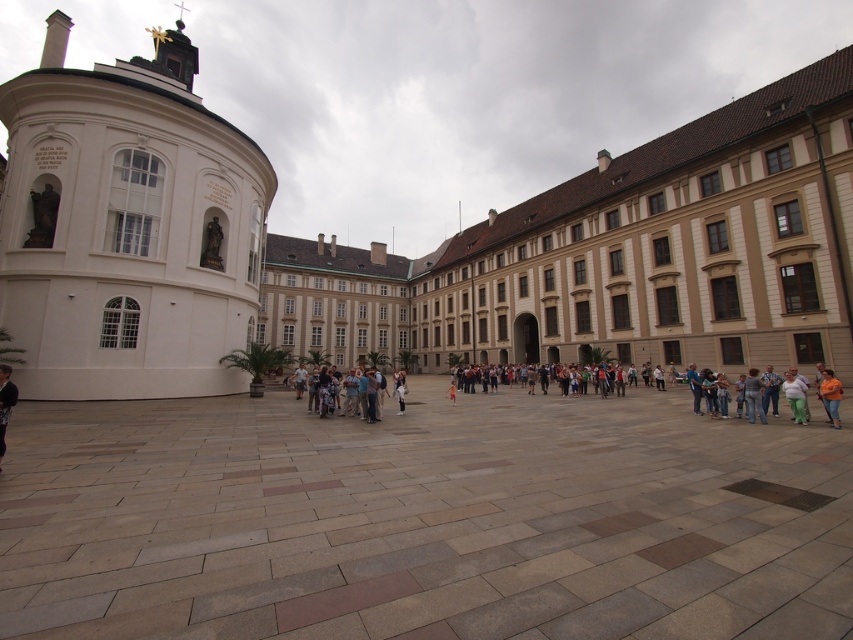
Question: Which point is farther to the camera?

Choices:
 (A) (376, 392)
 (B) (753, 380)
 (C) (169, 300)

Answer: (C)

Question: Among these objects, which one is nearest to the camera?

Choices:
 (A) light brown leather jacket at center
 (B) white smooth dome at left
 (C) smooth stone courtyard at center
 (D) beige stone palace at center

Answer: (C)

Question: Observing the image, what is the correct spatial positioning of white smooth dome at left in reference to green fabric pants at lower right?

Choices:
 (A) left
 (B) right

Answer: (A)

Question: Is smooth stone courtyard at center to the right of white smooth dome at left from the viewer's perspective?

Choices:
 (A) yes
 (B) no

Answer: (A)

Question: Is dark blue jeans at lower left positioned at the back of jeans at center?

Choices:
 (A) yes
 (B) no

Answer: (B)

Question: Estimate the real-world distances between objects in this image. Which object is farther from the light brown leather jacket at center?

Choices:
 (A) smooth stone courtyard at center
 (B) jeans at center
 (C) green fabric pants at lower right
 (D) beige stone palace at center

Answer: (D)